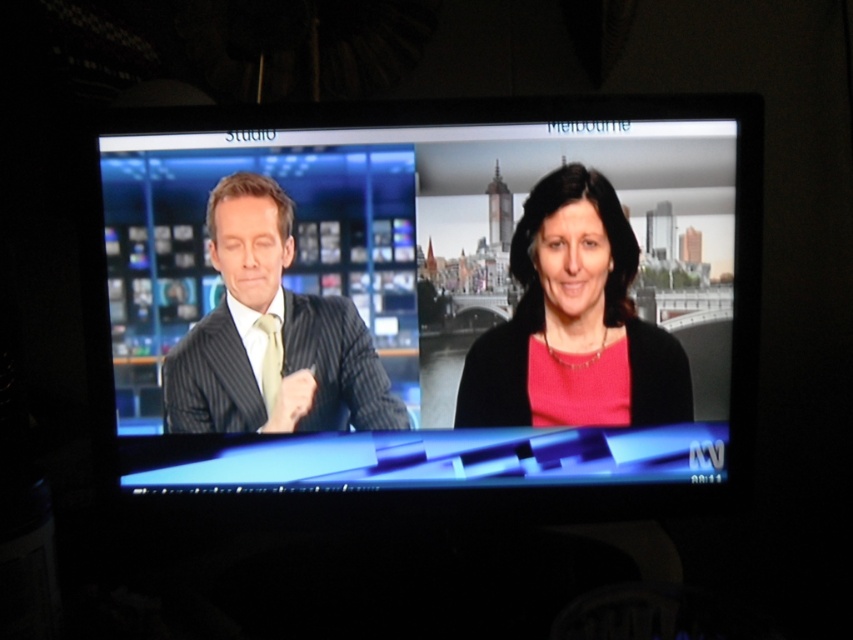
Based on the scene description, where exactly is the matte black suit at center located in terms of its 2D coordinates?

The matte black suit at center is located at the 2D coordinates point (433, 294).

You are designing a poster for a news channel and need to place two suits on the poster. The poster has limited space between them. Given that the matte black suit at center and the pinstriped suit at left must be placed exactly as described, can the two suits fit within a 4 inch space between them?

The matte black suit at center is 3.65 inches away from the pinstriped suit at left. Since 3.65 inches is less than 4 inches, the two suits can fit within the 4 inch space between them.